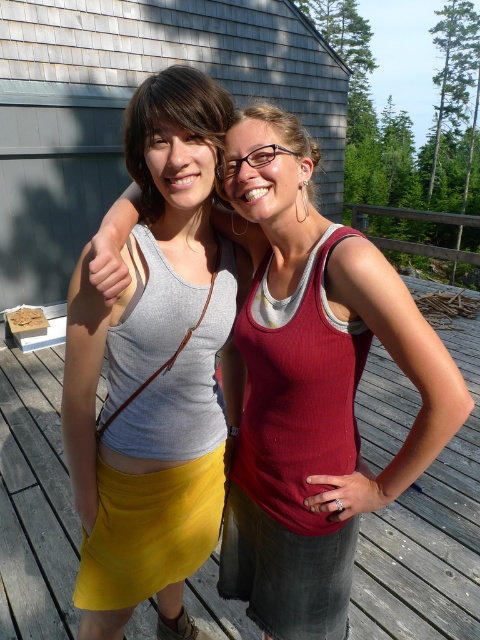
You are a photographer trying to capture a group photo of two people standing on a wooden deck. You need to ensure there is enough space between them for a third person to stand comfortably. The recommended minimum distance for three people is 8 feet. Based on the scene, can the third person fit between the yellow fabric skirt at center and the matte gray tank top at center?

The distance between the yellow fabric skirt at center and the matte gray tank top at center is 8.27 feet, which exceeds the recommended minimum of 8 feet. Therefore, there is enough space for a third person to stand comfortably between them.

You are taking a photo of two people standing on a wooden deck. You notice two specific points in the image at coordinates point (x=218, y=273) and point (x=167, y=116). Based on their positions, which point is closer to the camera?

Point (x=167, y=116) is closer to the camera because it is in front of point (x=218, y=273).

You are a photographer trying to capture the two people in the image. The gray matte tank top at center is represented by point (154,362). Where should you position your camera to ensure the gray matte tank top at center is centered in the frame?

To center the gray matte tank top at center, position the camera so that the point (154,362) is at the center of the frame.